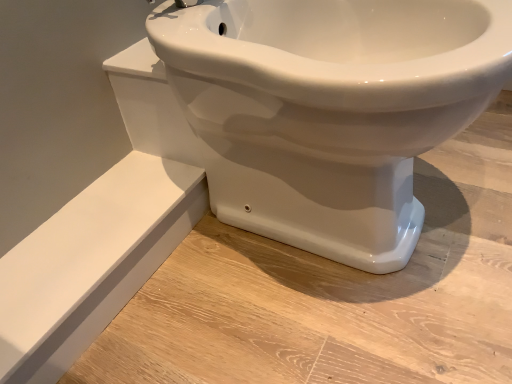
You are a GUI agent. You are given a task and a screenshot of the screen. Output one action in this format:
    pyautogui.click(x=<x>, y=<y>)
    Task: Click on the white glossy toilet at center
    The image size is (512, 384).
    Given the screenshot: What is the action you would take?
    pyautogui.click(x=330, y=110)

This screenshot has width=512, height=384. What do you see at coordinates (330, 110) in the screenshot?
I see `white glossy toilet at center` at bounding box center [330, 110].

You are a GUI agent. You are given a task and a screenshot of the screen. Output one action in this format:
    pyautogui.click(x=<x>, y=<y>)
    Task: Click on the white glossy toilet at center
    Image resolution: width=512 pixels, height=384 pixels.
    Given the screenshot: What is the action you would take?
    pyautogui.click(x=330, y=110)